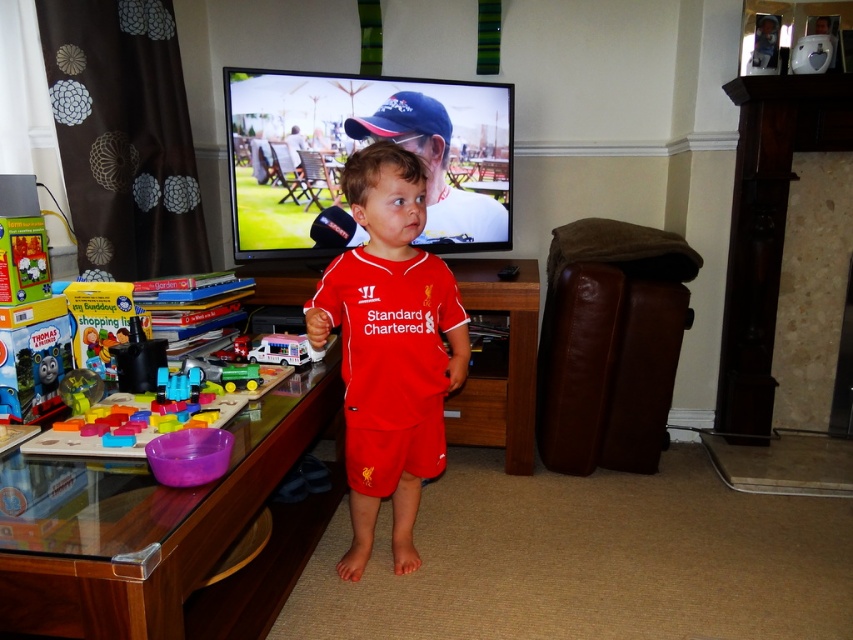
Does blue fabric baseball cap at upper center appear over white plastic toy truck at center?

Yes.

Who is more forward, (381, 122) or (250, 355)?

Point (250, 355) is in front.

Is point (387, 108) positioned behind point (302, 349)?

Yes.

Find the location of a particular element. blue fabric baseball cap at upper center is located at coordinates (402, 118).

Is point (355, 454) closer to camera compared to point (270, 352)?

No, (355, 454) is behind (270, 352).

Does matte red jersey at center appear on the left side of white plastic toy truck at center?

No, matte red jersey at center is not to the left of white plastic toy truck at center.

Is point (328, 300) positioned after point (251, 349)?

No.

Locate an element on the screen. The height and width of the screenshot is (640, 853). matte red jersey at center is located at coordinates (389, 348).

Is point (381, 426) closer to camera compared to point (409, 104)?

Yes, point (381, 426) is closer to viewer.

Between matte red jersey at center and blue fabric baseball cap at upper center, which one appears on the right side from the viewer's perspective?

Positioned to the right is matte red jersey at center.

Where is `matte red jersey at center`? The height and width of the screenshot is (640, 853). matte red jersey at center is located at coordinates (389, 348).

Find the location of a particular element. This screenshot has width=853, height=640. matte red jersey at center is located at coordinates (389, 348).